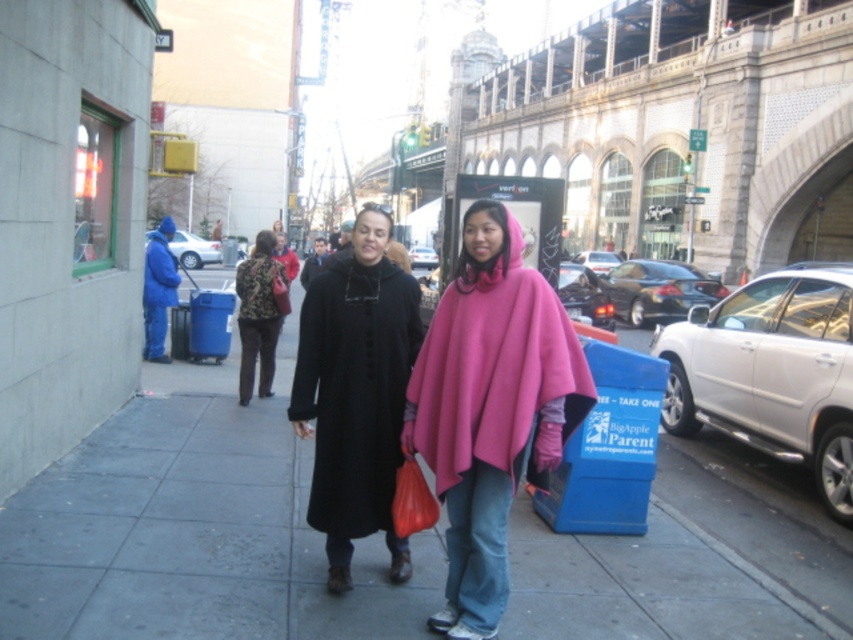
You are standing on the street and want to walk to the smooth concrete sidewalk at center. According to the scene description, where should you head?

The smooth concrete sidewalk at center is located at point [195,528], so you should head towards that coordinate to reach it.

You are standing on the sidewalk and see two points marked in the scene. The first point is at coordinates point (688, 500) and the second point is at coordinates point (242, 380). Which point is closer to your current position if you are facing the direction the two people are walking?

Point (242, 380) is closer to your current position because it is behind point (688, 500), which is in front of it.

You are a delivery drone operator trying to deliver a package to a person on the sidewalk. The package is addressed to the person wearing a pink fleece poncho at center. According to the coordinates provided, where should you aim the drone to drop the package?

The pink fleece poncho at center is located at coordinates point (490, 406), so you should aim the drone at that point to deliver the package.